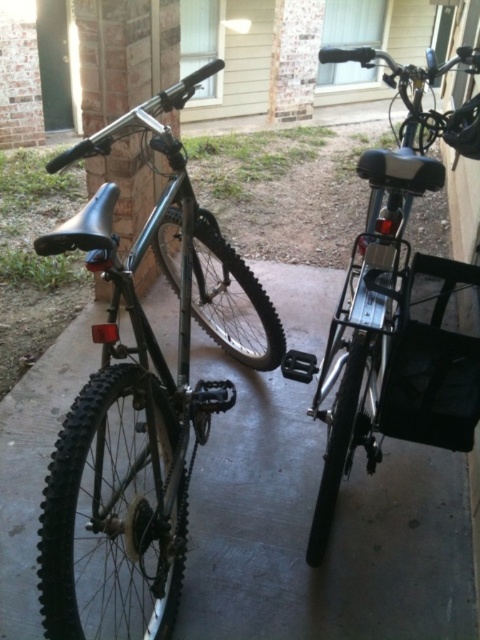
Question: Which object is positioned closest to the matte black bicycle at left?

Choices:
 (A) metallic silver bicycle at right
 (B) matte black bicycle at center

Answer: (B)

Question: Can you confirm if matte black bicycle at left is smaller than metallic silver bicycle at right?

Choices:
 (A) no
 (B) yes

Answer: (A)

Question: Which point is farther from the camera taking this photo?

Choices:
 (A) (187, 426)
 (B) (363, 168)
 (C) (230, 362)

Answer: (C)

Question: From the image, what is the correct spatial relationship of matte black bicycle at center in relation to matte black bicycle at left?

Choices:
 (A) left
 (B) right

Answer: (A)

Question: Is matte black bicycle at left thinner than metallic silver bicycle at right?

Choices:
 (A) yes
 (B) no

Answer: (A)

Question: Which point is closer to the camera?

Choices:
 (A) metallic silver bicycle at right
 (B) matte black bicycle at center
 (C) matte black bicycle at left

Answer: (C)